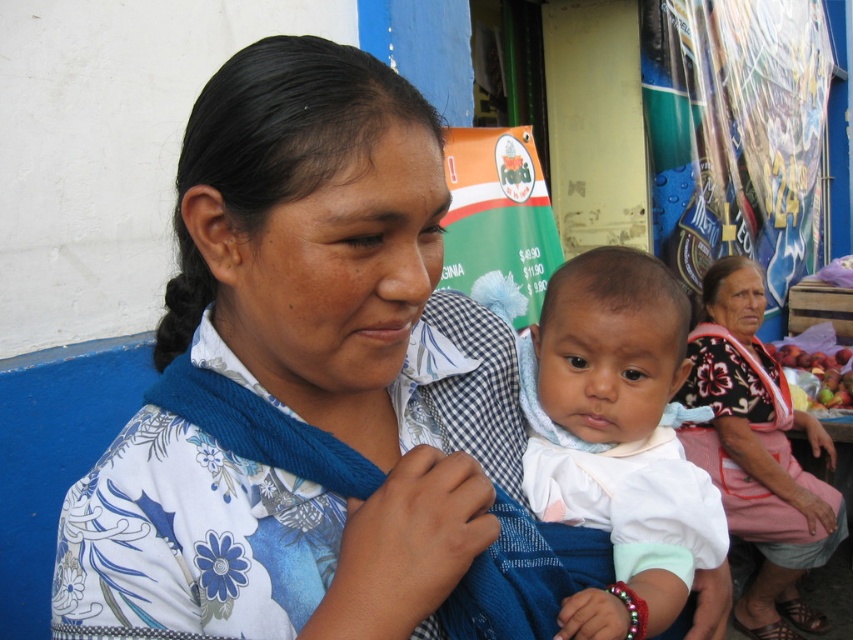
You are a photographer setting up for a portrait. You see the white soft cloth at center and the floral fabric dress at lower right in the scene. Which object is shorter?

The white soft cloth at center is not as tall as the floral fabric dress at lower right, so the white soft cloth at center is shorter.

You are a photographer standing at the camera position. You want to place a small prop at a point that is exactly 3.38 feet away from the camera. Is the point labeled as point (x=665, y=449) suitable for placing the prop?

Yes, the point labeled as point (x=665, y=449) is exactly 3.38 feet away from the camera, making it suitable for placing the prop.